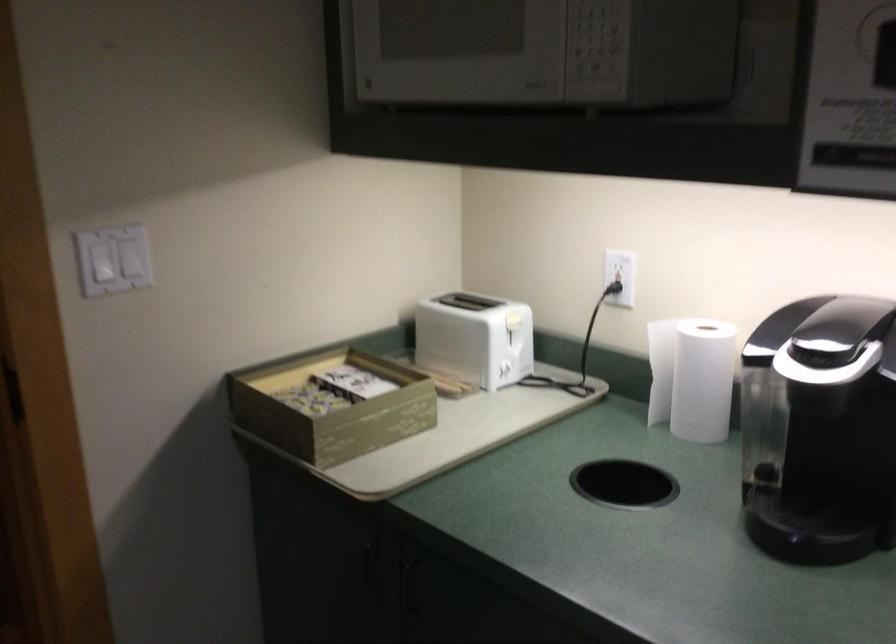
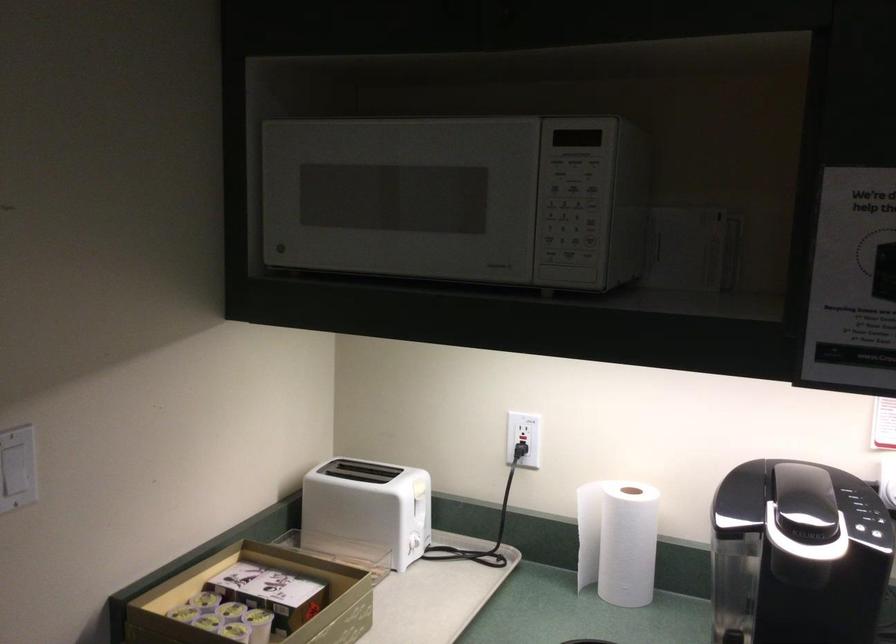
Where in the second image is the point corresponding to (319,382) from the first image?

(227, 592)